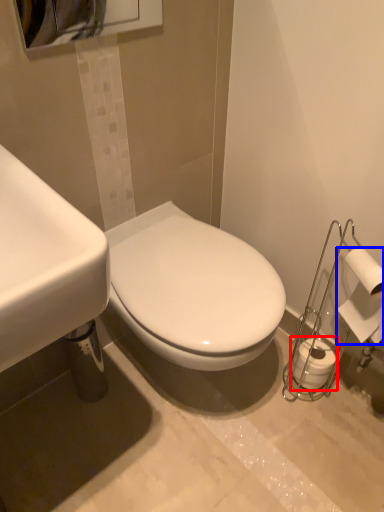
Question: Among these objects, which one is nearest to the camera, toilet paper (highlighted by a red box) or toilet paper (highlighted by a blue box)?

Choices:
 (A) toilet paper
 (B) toilet paper

Answer: (B)